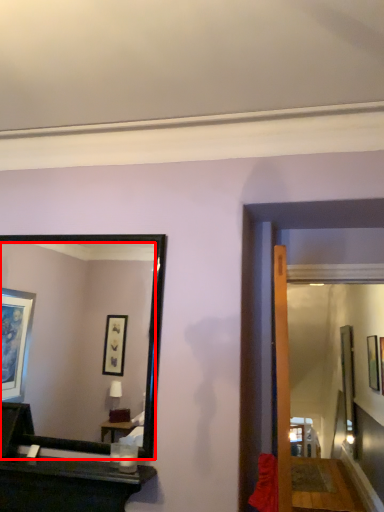
Question: Where is mirror (annotated by the red box) located in relation to picture frame in the image?

Choices:
 (A) right
 (B) left

Answer: (B)